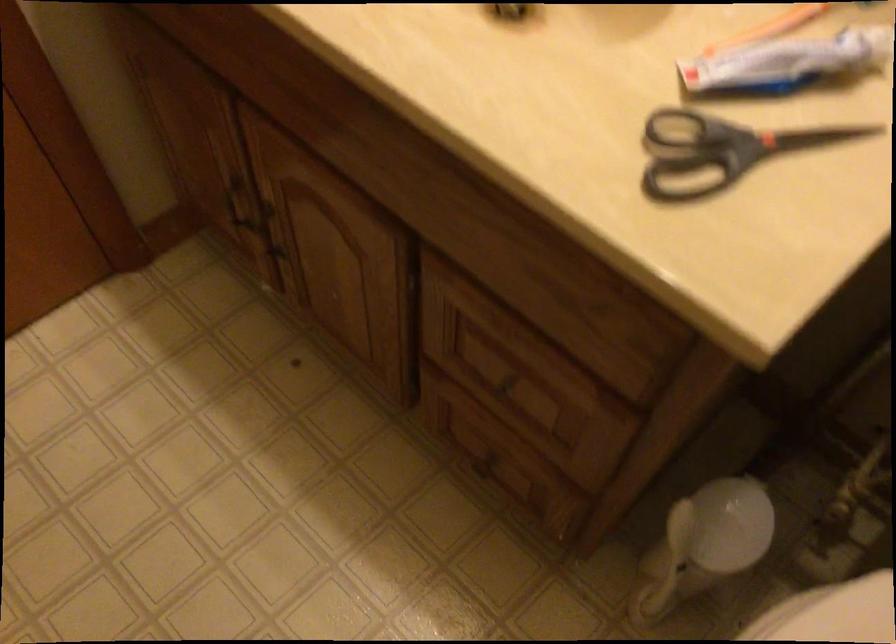
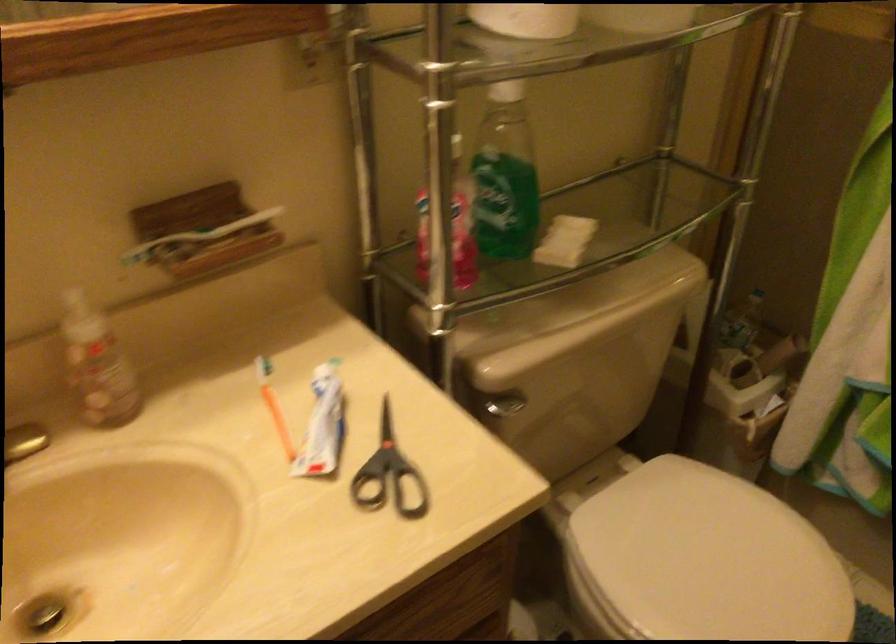
Where in the second image is the point corresponding to point 662,147 from the first image?

(391, 489)